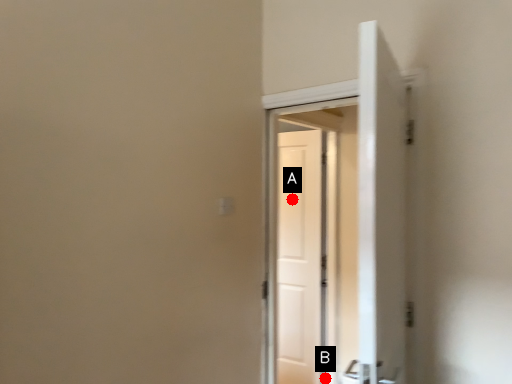
Question: Two points are circled on the image, labeled by A and B beside each circle. Which point is further to the camera?

Choices:
 (A) A is further
 (B) B is further

Answer: (A)